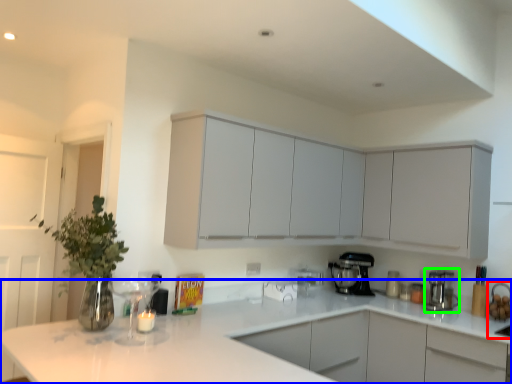
Question: Considering the real-world distances, which object is closest to sink (highlighted by a red box)? countertop (highlighted by a blue box) or kitchen appliance (highlighted by a green box).

Choices:
 (A) countertop
 (B) kitchen appliance

Answer: (B)